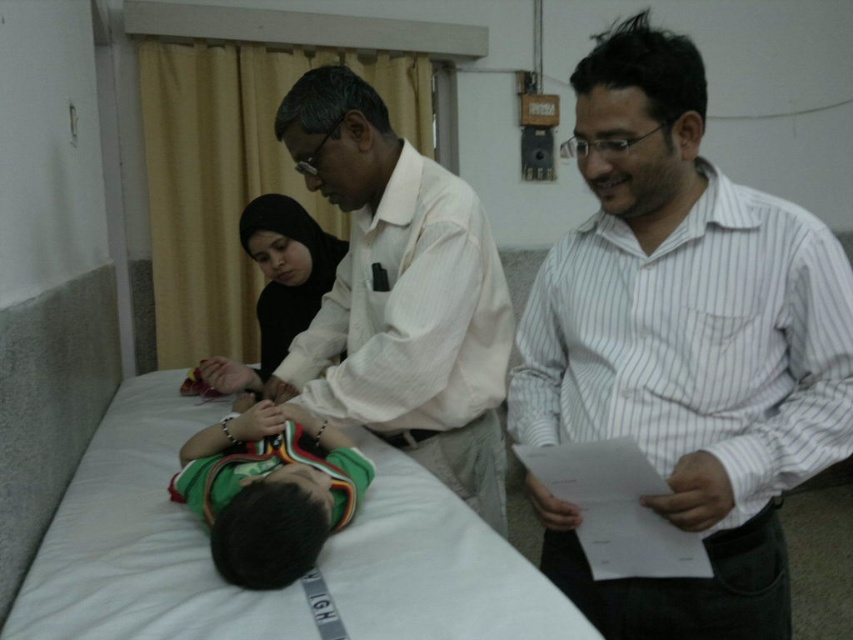
You are a nurse in a hospital room. You need to place a medical kit on the white fabric bed at center so that it is closer to the matte black hijab at center than to the edge of the bed. Is this possible?

The white fabric bed at center and matte black hijab at center are 17.26 inches apart. Since the distance between them is fixed, placing the medical kit closer to the matte black hijab at center than to the edge of the bed depends on the bed dimensions. However, without knowing the bed size, we can only confirm their separation is 17.26 inches.

You are a nurse in this hospital room. You need to reach the white cotton shirt at center to check its condition. However, the white fabric bed at center is blocking your path. Is there a way around the bed to access the shirt?

The white fabric bed at center is in front of the white cotton shirt at center, so you can go around the sides or the back of the bed to access the shirt.

Please describe the location of the point marked at coordinates (140, 541) in the image.

The point marked at coordinates (140, 541) is located on the white fabric bed at center.